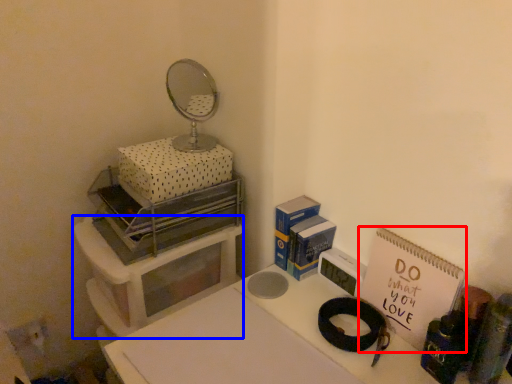
Question: Which of the following is the closest to the observer, notebook (highlighted by a red box) or furniture (highlighted by a blue box)?

Choices:
 (A) notebook
 (B) furniture

Answer: (A)